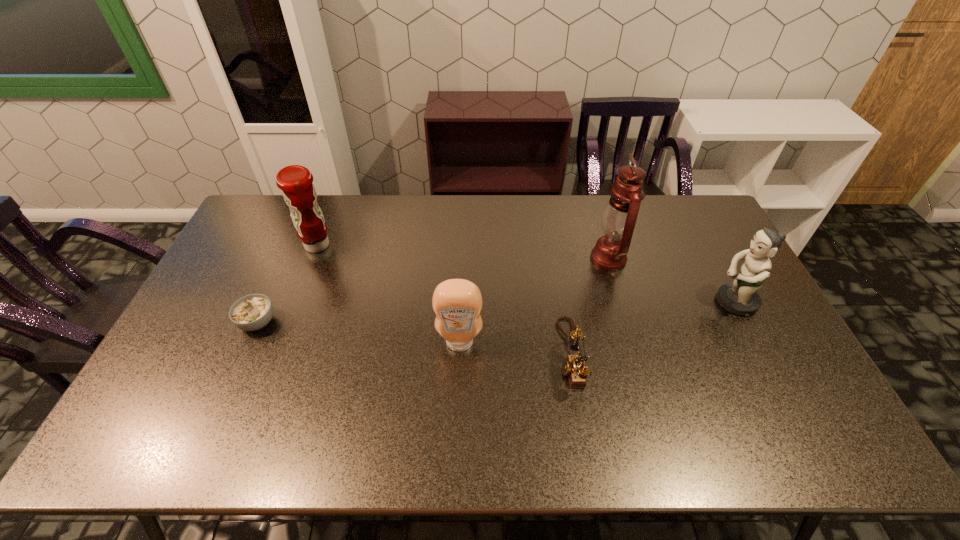
Where is `object located in the far edge section of the desktop`? The width and height of the screenshot is (960, 540). object located in the far edge section of the desktop is located at coordinates (296, 182).

The height and width of the screenshot is (540, 960). I want to click on object positioned at the left edge, so click(252, 312).

Identify the location of object that is at the right edge. The width and height of the screenshot is (960, 540). (740, 297).

Where is `free region at the far edge`? This screenshot has height=540, width=960. free region at the far edge is located at coordinates click(x=511, y=226).

Find the location of a particular element. The image size is (960, 540). vacant space at the left edge of the desktop is located at coordinates (171, 399).

In the image, there is a desktop. Identify the location of vacant space at the right edge. (786, 418).

Find the location of `vacant region at the far left corner of the desktop`. vacant region at the far left corner of the desktop is located at coordinates (263, 200).

Where is `blank area at the far right corner`? The width and height of the screenshot is (960, 540). blank area at the far right corner is located at coordinates [x=687, y=208].

Identify the location of empty location between the right condiment and the telephone. The image size is (960, 540). (515, 349).

You are a GUI agent. You are given a task and a screenshot of the screen. Output one action in this format:
    pyautogui.click(x=<x>, y=<y>)
    Task: Click on the free space between the fourth tallest object and the taller condiment
    Image resolution: width=960 pixels, height=540 pixels.
    Given the screenshot: What is the action you would take?
    pyautogui.click(x=389, y=294)